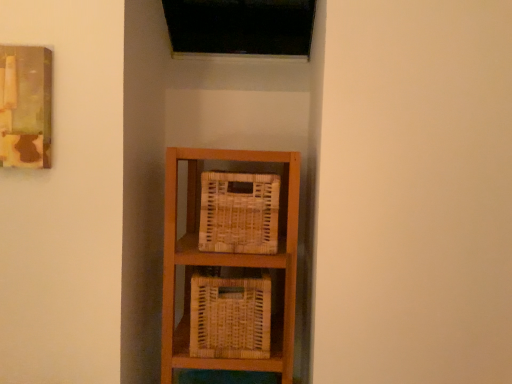
Question: Is wooden painting at upper left at the right side of woven wood basket at center, arranged as the first basket when ordered from the bottom?

Choices:
 (A) no
 (B) yes

Answer: (A)

Question: Can you confirm if wooden painting at upper left is wider than woven wood basket at center, acting as the second basket starting from the top?

Choices:
 (A) yes
 (B) no

Answer: (B)

Question: Does wooden painting at upper left appear on the left side of woven wood basket at center, acting as the second basket starting from the top?

Choices:
 (A) yes
 (B) no

Answer: (A)

Question: Can you confirm if wooden painting at upper left is smaller than woven wood basket at center, arranged as the first basket when ordered from the bottom?

Choices:
 (A) yes
 (B) no

Answer: (A)

Question: From the image's perspective, is wooden painting at upper left above woven wood basket at center, arranged as the first basket when ordered from the bottom?

Choices:
 (A) no
 (B) yes

Answer: (B)

Question: Can you confirm if wooden painting at upper left is thinner than woven wood basket at center, acting as the second basket starting from the top?

Choices:
 (A) yes
 (B) no

Answer: (A)

Question: Is woven wood basket at center, acting as the second basket starting from the top, outside wooden painting at upper left?

Choices:
 (A) no
 (B) yes

Answer: (B)

Question: Is woven wood basket at center, arranged as the first basket when ordered from the bottom, thinner than wooden painting at upper left?

Choices:
 (A) no
 (B) yes

Answer: (A)

Question: From a real-world perspective, is woven wood basket at center, arranged as the first basket when ordered from the bottom, located beneath wooden painting at upper left?

Choices:
 (A) no
 (B) yes

Answer: (B)

Question: Could you tell me if woven wood basket at center, arranged as the first basket when ordered from the bottom, is turned towards wooden painting at upper left?

Choices:
 (A) yes
 (B) no

Answer: (B)

Question: Does woven wood basket at center, arranged as the first basket when ordered from the bottom, have a greater width compared to wooden painting at upper left?

Choices:
 (A) yes
 (B) no

Answer: (A)

Question: Does woven wood basket at center, arranged as the first basket when ordered from the bottom, appear on the left side of wooden painting at upper left?

Choices:
 (A) no
 (B) yes

Answer: (A)

Question: From a real-world perspective, is woven natural basket at center, marked as the 2th basket in a bottom-to-top arrangement, under woven wood basket at center, arranged as the first basket when ordered from the bottom?

Choices:
 (A) no
 (B) yes

Answer: (A)